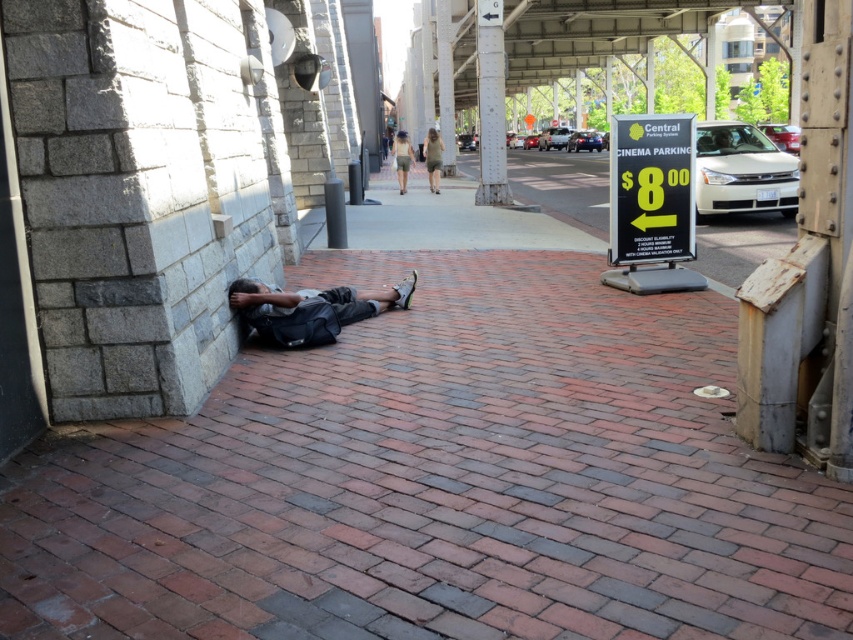
You are standing at the entrance of the bridge and see the dark gray fabric bag at center. If you walk straight ahead, will you reach the bag before the metal railing?

The dark gray fabric bag at center is located at point (311, 308) in 2D coordinates, which is closer to the entrance than the metal railing. Therefore, you will reach the dark gray fabric bag at center before the metal railing.

You are standing at the point marked by the coordinates point (311, 308) in the image. Looking around, you see a dark gray fabric bag at center. Which direction should you walk to reach the gray stone wall on the left side?

The gray stone wall on the left side is to your left, so you should walk left to reach it.